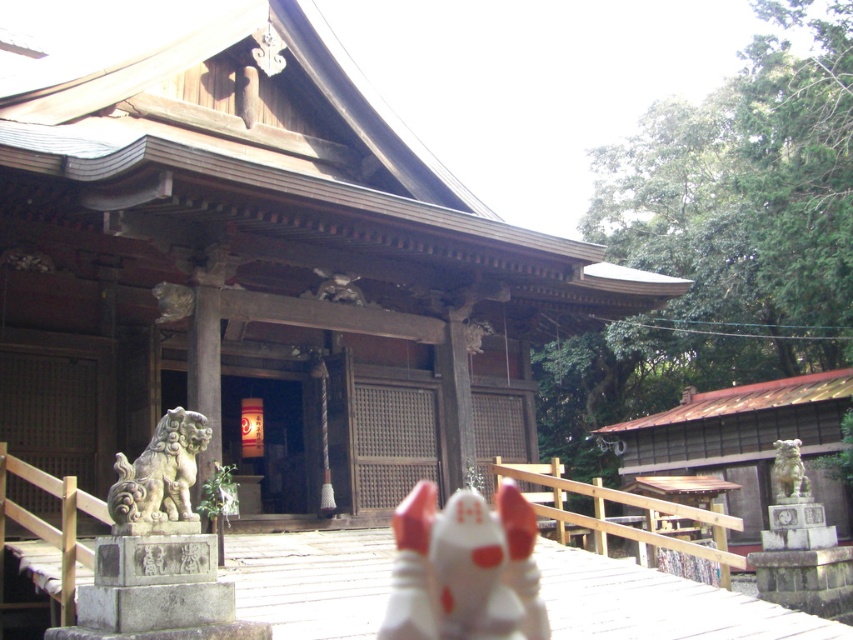
Which is in front, point (260, 468) or point (780, 449)?

Point (780, 449)

Who is positioned more to the right, smooth stone statue at center or matte stone lion at right?

From the viewer's perspective, matte stone lion at right appears more on the right side.

This screenshot has height=640, width=853. In order to click on smooth stone statue at center in this screenshot , I will do `click(267, 438)`.

The height and width of the screenshot is (640, 853). I want to click on smooth stone statue at center, so click(x=267, y=438).

Which of these two, white matte fox at center or gray stone lion at left, stands shorter?

white matte fox at center

I want to click on white matte fox at center, so click(463, 568).

Is white matte fox at center shorter than smooth stone statue at center?

Indeed, white matte fox at center has a lesser height compared to smooth stone statue at center.

Does point (422, 529) come behind point (210, 422)?

Yes, point (422, 529) is farther from viewer.

Is point (457, 532) positioned behind point (250, 381)?

No, (457, 532) is in front of (250, 381).

At what (x,y) coordinates should I click in order to perform the action: click on white matte fox at center. Please return your answer as a coordinate pair (x, y). The image size is (853, 640). Looking at the image, I should click on (463, 568).